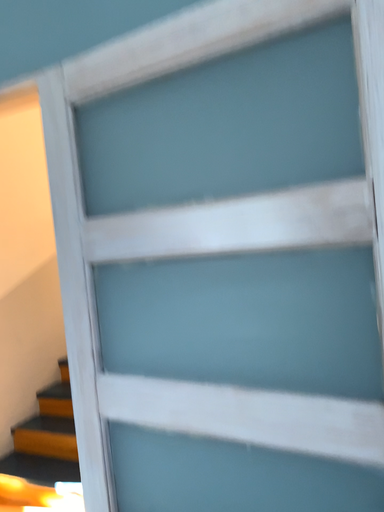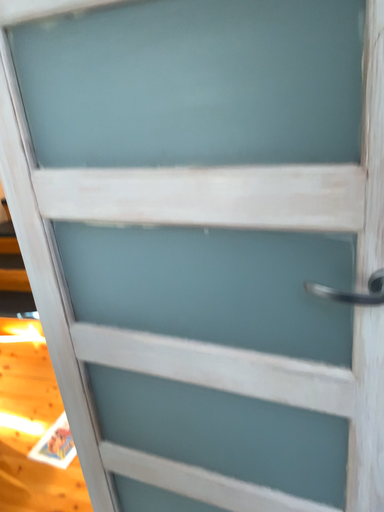
Question: Which way did the camera rotate in the video?

Choices:
 (A) rotated right
 (B) rotated left

Answer: (A)